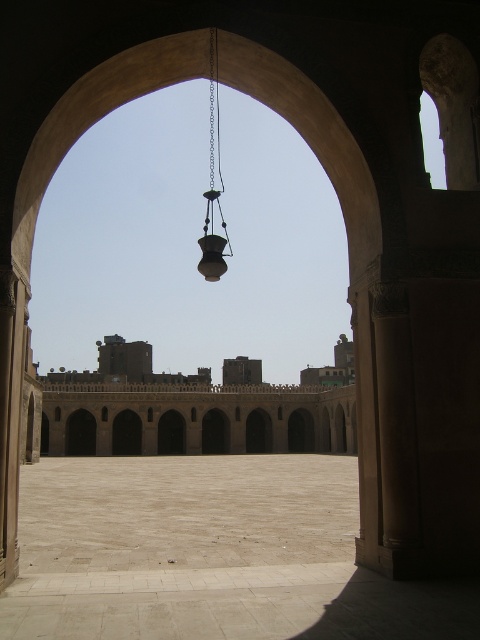
You are standing in front of the beige stone palace at center and the metallic chain at center. Which object is taller?

The metallic chain at center is taller than the beige stone palace at center.

You are standing in the courtyard and want to hang a new lantern. The beige stone palace at center is to the left of the metallic chain at center. Which object is closer to the entrance of the courtyard?

The beige stone palace at center is closer to the entrance of the courtyard because it is positioned on the left side of the metallic chain at center, which is further away from the entrance.